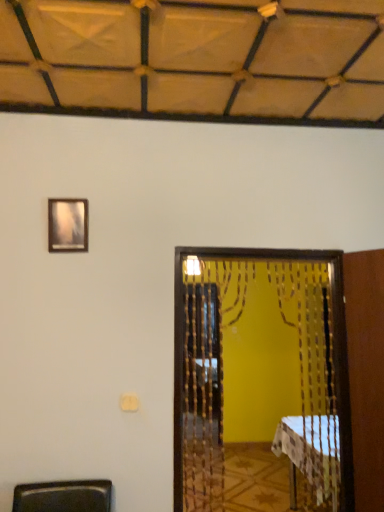
What are the coordinates of `empty space that is ontop of wooden beaded screen door at center` in the screenshot? It's located at (256, 255).